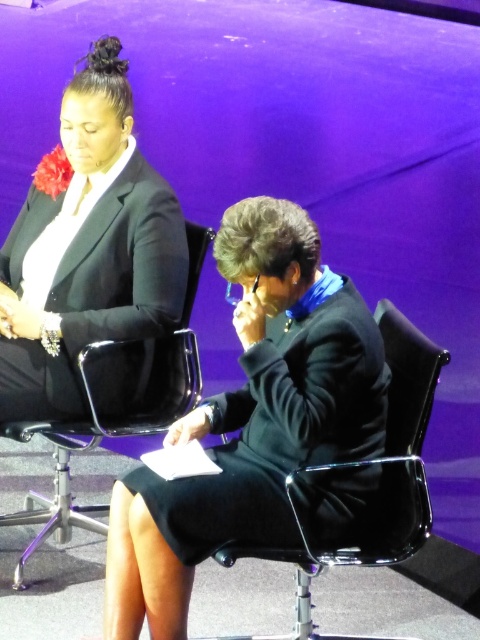
Is black matte dress at lower center smaller than black plastic chair at center?

Indeed, black matte dress at lower center has a smaller size compared to black plastic chair at center.

Based on the photo, who is more forward, (271, 468) or (180, 353)?

Positioned in front is point (271, 468).

Find the location of a particular element. black matte dress at lower center is located at coordinates (278, 429).

Based on the photo, does black plastic swivel chair at center have a greater height compared to black plastic chair at center?

No.

Can you confirm if black plastic swivel chair at center is bigger than black plastic chair at center?

No, black plastic swivel chair at center is not bigger than black plastic chair at center.

Who is more distant from viewer, (397, 320) or (71, 497)?

The point (71, 497) is behind.

Locate an element on the screen. black plastic swivel chair at center is located at coordinates (380, 483).

Can you confirm if black matte dress at lower center is thinner than black matte blazer at upper left?

No, black matte dress at lower center is not thinner than black matte blazer at upper left.

Between black matte dress at lower center and black matte blazer at upper left, which one is positioned lower?

Positioned lower is black matte dress at lower center.

Between point (352, 416) and point (31, 196), which one is positioned in front?

Positioned in front is point (352, 416).

Where is `black matte dress at lower center`? The width and height of the screenshot is (480, 640). black matte dress at lower center is located at coordinates (278, 429).